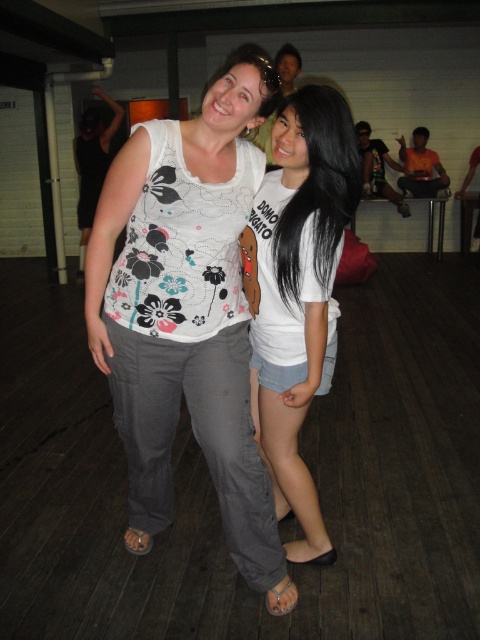
Who is taller, white printed tank top at center or white cotton t-shirt at center?

Standing taller between the two is white printed tank top at center.

Does point (118, 264) lie behind point (249, 260)?

That is False.

You are a GUI agent. You are given a task and a screenshot of the screen. Output one action in this format:
    pyautogui.click(x=<x>, y=<y>)
    Task: Click on the white printed tank top at center
    The image size is (480, 640).
    Given the screenshot: What is the action you would take?
    pyautogui.click(x=187, y=314)